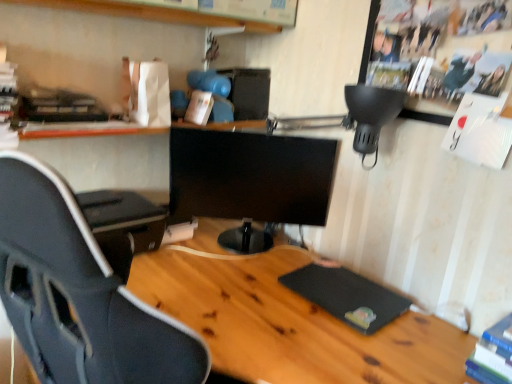
This screenshot has height=384, width=512. I want to click on unoccupied space behind black rubber mousepad at lower right, so click(300, 255).